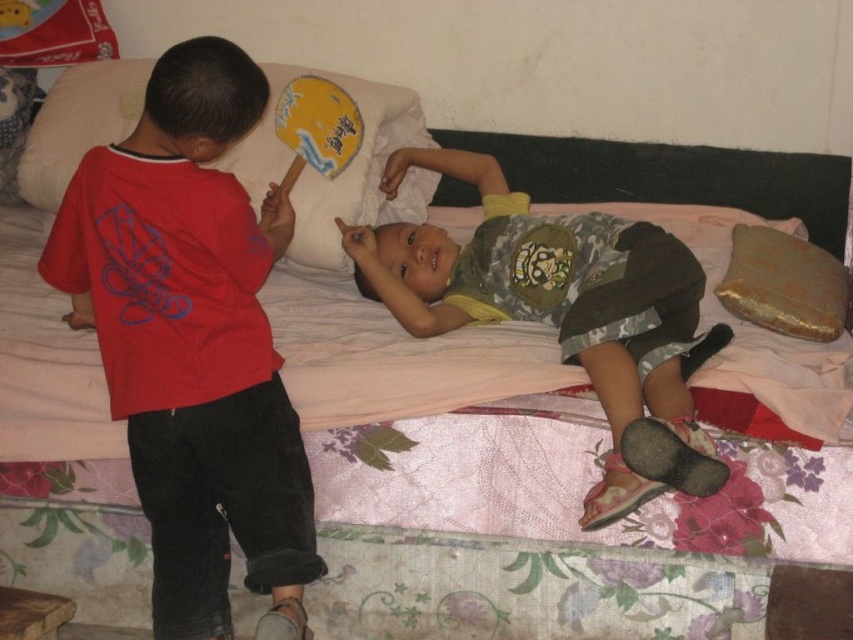
You are standing in the room and want to hand the camouflage fabric shirt at center to a friend who is 1.7 meters tall. Can the friend reach it without moving?

The camouflage fabric shirt at center and viewer are 1.62 meters apart. Since the friend is 1.7 meters tall, they can likely reach it without moving as their height is slightly taller than the distance.

You are a photographer trying to capture a closeup of the golden pillow. You see two points in the image labeled as point (409, 307) and point (780, 285). Which point should you focus on to ensure the golden pillow is in focus?

Point (409, 307) is further to the viewer than point (780, 285), so focusing on point (409, 307) will ensure the golden pillow is in focus.

You are standing in the room and want to reach the point marked at coordinates [668,397]. If your arm can extend 1.5 meters, can you touch it without moving closer?

The point marked at coordinates [668,397] is 1.75 meters away from the viewer. Since your arm can only extend 1.5 meters, you cannot touch it without moving closer.